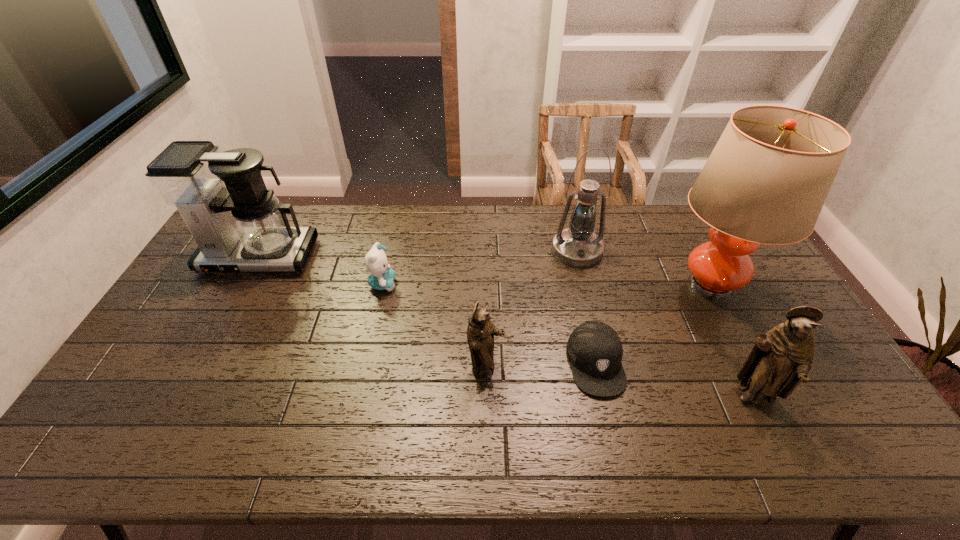
Where is `object at the right edge`? object at the right edge is located at coordinates (766, 181).

Identify the location of object present at the far left corner. (242, 227).

Image resolution: width=960 pixels, height=540 pixels. I want to click on free space at the far edge of the desktop, so click(x=676, y=205).

Locate an element on the screen. This screenshot has width=960, height=540. free point at the near edge is located at coordinates (675, 398).

Identify the location of vacant space at the left edge of the desktop. This screenshot has width=960, height=540. (162, 342).

Where is `vacant region at the right edge`? The image size is (960, 540). vacant region at the right edge is located at coordinates (785, 299).

Find the location of `blank space at the near right corner of the desktop`. blank space at the near right corner of the desktop is located at coordinates (816, 403).

Identify the location of vacant space in between the cap and the coffee maker. (427, 310).

Image resolution: width=960 pixels, height=540 pixels. Identify the location of vacant space that is in between the oil lamp and the third shortest object. (532, 310).

This screenshot has width=960, height=540. Find the location of `vacant area that lies between the fifth tallest object and the second shortest object`. vacant area that lies between the fifth tallest object and the second shortest object is located at coordinates (434, 326).